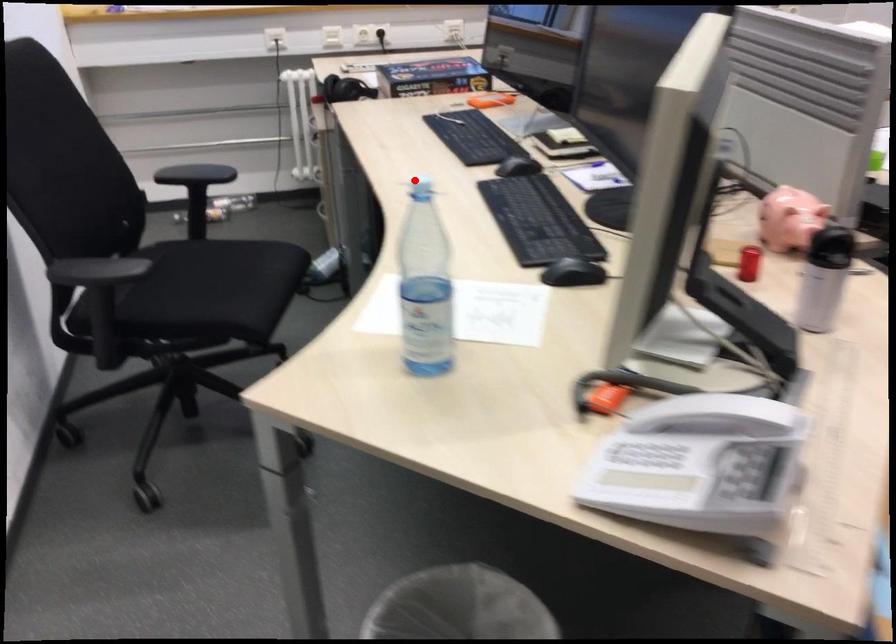
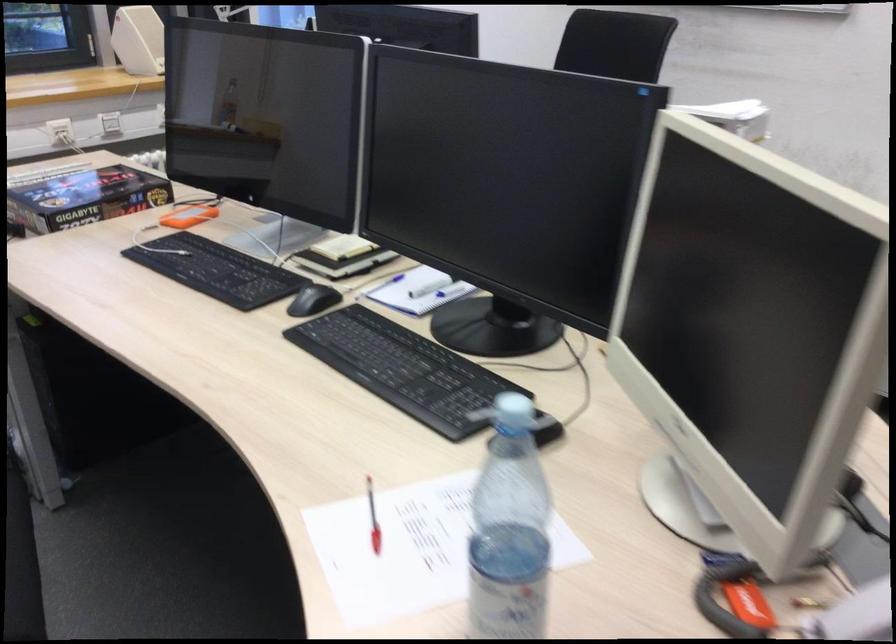
Question: I am providing you with two images of the same scene from different viewpoints. Image1 has a red point marked. In image2, the corresponding 3D location appears at what relative position? Reply with the corresponding letter.

Choices:
 (A) Closer
 (B) Farther

Answer: (A)